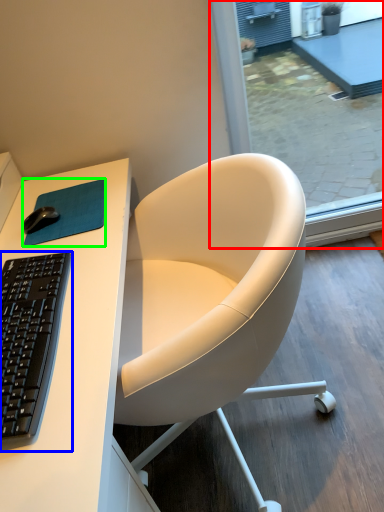
Question: Estimate the real-world distances between objects in this image. Which object is farther from screen door (highlighted by a red box), computer keyboard (highlighted by a blue box) or mousepad (highlighted by a green box)?

Choices:
 (A) computer keyboard
 (B) mousepad

Answer: (A)